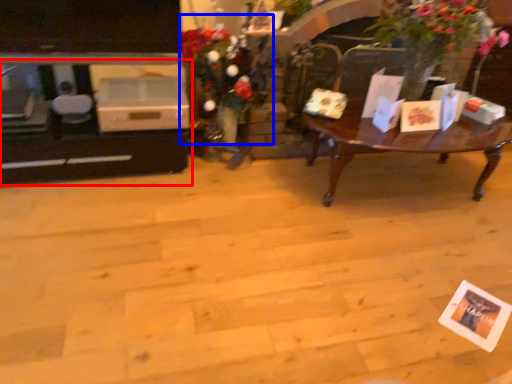
Question: Among these objects, which one is nearest to the camera, entertainment center (highlighted by a red box) or floral arrangement (highlighted by a blue box)?

Choices:
 (A) entertainment center
 (B) floral arrangement

Answer: (B)